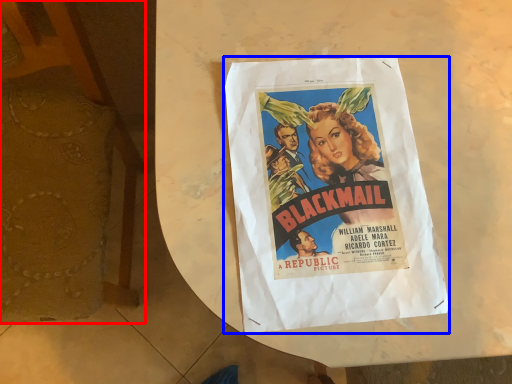
Question: Which of the following is the farthest to the observer, armchair (highlighted by a red box) or poster (highlighted by a blue box)?

Choices:
 (A) armchair
 (B) poster

Answer: (B)